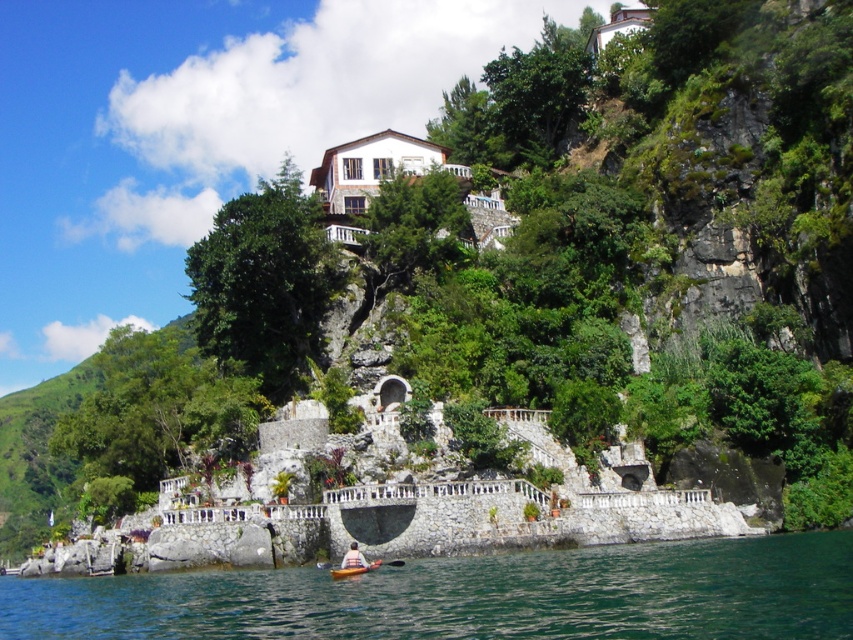
Question: Is matte yellow kayak at lower center below white plastic paddle at lower center?

Choices:
 (A) no
 (B) yes

Answer: (A)

Question: Does matte yellow kayak at lower center appear over white plastic paddle at lower center?

Choices:
 (A) yes
 (B) no

Answer: (A)

Question: Is white fabric kayak at lower center above white plastic paddle at lower center?

Choices:
 (A) no
 (B) yes

Answer: (B)

Question: Among these objects, which one is nearest to the camera?

Choices:
 (A) white fabric kayak at lower center
 (B) white plastic paddle at lower center
 (C) matte yellow kayak at lower center
 (D) green water at lower center

Answer: (D)

Question: Which point is farther to the camera?

Choices:
 (A) white plastic paddle at lower center
 (B) white fabric kayak at lower center

Answer: (A)

Question: Which of the following is the closest to the observer?

Choices:
 (A) (389, 563)
 (B) (3, 600)
 (C) (357, 573)
 (D) (346, 564)

Answer: (C)